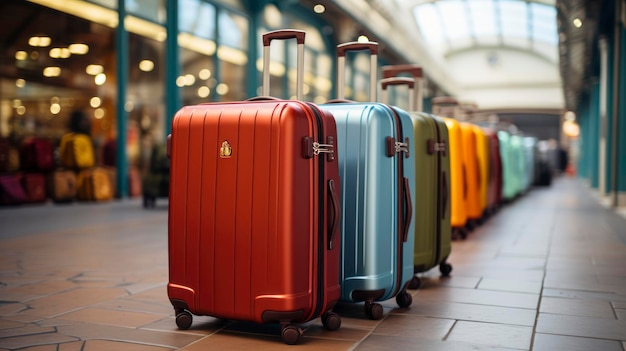
Identify the location of handles. The image size is (626, 351). (292, 32), (352, 46), (404, 80), (416, 69), (448, 100), (471, 104).